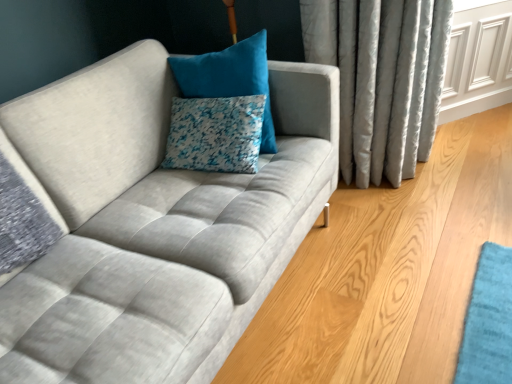
Question: From the image's perspective, is white textured pillow at center, acting as the 2th pillow starting from the top, positioned above or below velvet blue pillow at upper center, which is the 1th pillow in top-to-bottom order?

Choices:
 (A) above
 (B) below

Answer: (B)

Question: Is white textured pillow at center, acting as the 2th pillow starting from the top, in front of or behind velvet blue pillow at upper center, which is the 1th pillow in top-to-bottom order, in the image?

Choices:
 (A) front
 (B) behind

Answer: (B)

Question: Is white textured pillow at center, acting as the 2th pillow starting from the top, bigger or smaller than velvet blue pillow at upper center, which is the second pillow in bottom-to-top order?

Choices:
 (A) big
 (B) small

Answer: (B)

Question: Is velvet blue pillow at upper center, which is the second pillow in bottom-to-top order, wider or thinner than white textured pillow at center, which is counted as the 1th pillow, starting from the bottom?

Choices:
 (A) thin
 (B) wide

Answer: (B)

Question: From a real-world perspective, is velvet blue pillow at upper center, which is the 1th pillow in top-to-bottom order, above or below white textured pillow at center, acting as the 2th pillow starting from the top?

Choices:
 (A) below
 (B) above

Answer: (B)

Question: In the image, is velvet blue pillow at upper center, which is the 1th pillow in top-to-bottom order, on the left side or the right side of white textured pillow at center, acting as the 2th pillow starting from the top?

Choices:
 (A) left
 (B) right

Answer: (B)

Question: From the image's perspective, relative to white textured pillow at center, which is counted as the 1th pillow, starting from the bottom, is velvet blue pillow at upper center, which is the 1th pillow in top-to-bottom order, above or below?

Choices:
 (A) below
 (B) above

Answer: (B)